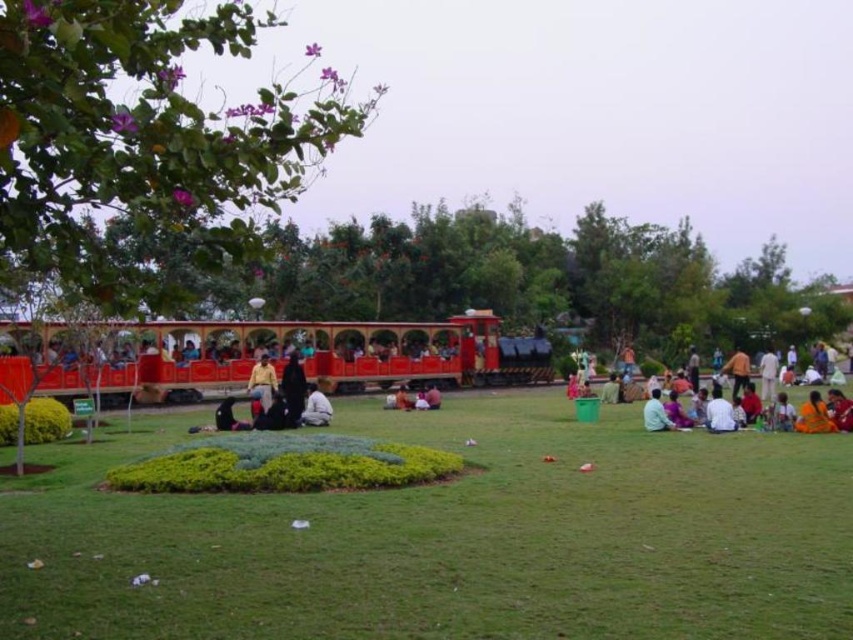
From the picture: Who is positioned more to the right, green grass at center or dark brown fabric at center?

green grass at center

Which is behind, point (671, 451) or point (229, 404)?

The point (229, 404) is behind.

Locate an element on the screen. The width and height of the screenshot is (853, 640). green grass at center is located at coordinates (450, 538).

Is white cotton shirt at lower right in front of dark brown fabric at center?

Yes, white cotton shirt at lower right is in front of dark brown fabric at center.

Based on the photo, can you confirm if white cotton shirt at lower right is positioned to the right of dark brown fabric at center?

Yes, white cotton shirt at lower right is to the right of dark brown fabric at center.

Between point (718, 401) and point (225, 417), which one is positioned in front?

Point (718, 401) is more forward.

Locate an element on the screen. The height and width of the screenshot is (640, 853). white cotton shirt at lower right is located at coordinates (718, 412).

Can you confirm if white cotton dress at right is positioned below black matte person at center?

Yes, white cotton dress at right is below black matte person at center.

Where is `white cotton dress at right`? white cotton dress at right is located at coordinates (793, 412).